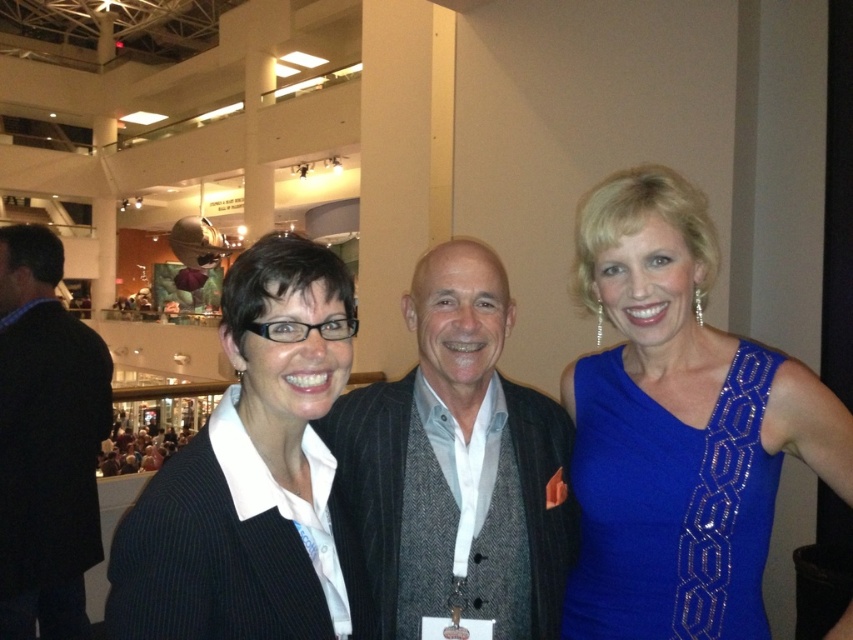
Question: Which object is the farthest from the dark gray textured suit at center?

Choices:
 (A) dark gray suit at center
 (B) black pinstripe blazer at center
 (C) blue sequined dress at right

Answer: (A)

Question: Which object is farther from the camera taking this photo?

Choices:
 (A) black pinstripe blazer at center
 (B) dark gray suit at center

Answer: (B)

Question: Is black pinstripe blazer at center thinner than dark gray suit at center?

Choices:
 (A) no
 (B) yes

Answer: (B)

Question: Can you confirm if blue sequined dress at right is thinner than black pinstripe blazer at center?

Choices:
 (A) no
 (B) yes

Answer: (A)

Question: Among these points, which one is farthest from the camera?

Choices:
 (A) (4, 481)
 (B) (219, 477)
 (C) (531, 605)

Answer: (A)

Question: Is black pinstripe blazer at center to the right of dark gray suit at center from the viewer's perspective?

Choices:
 (A) yes
 (B) no

Answer: (A)